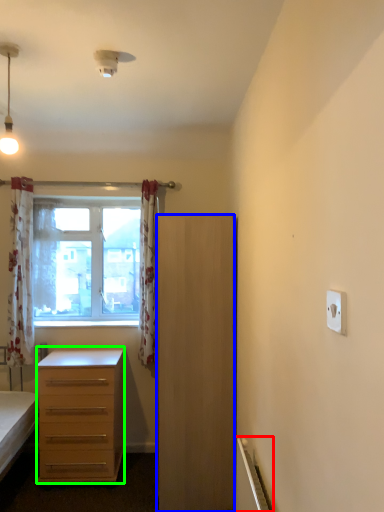
Question: Which is nearer to the radiator (highlighted by a red box)? cabinetry (highlighted by a blue box) or desk (highlighted by a green box).

Choices:
 (A) cabinetry
 (B) desk

Answer: (A)